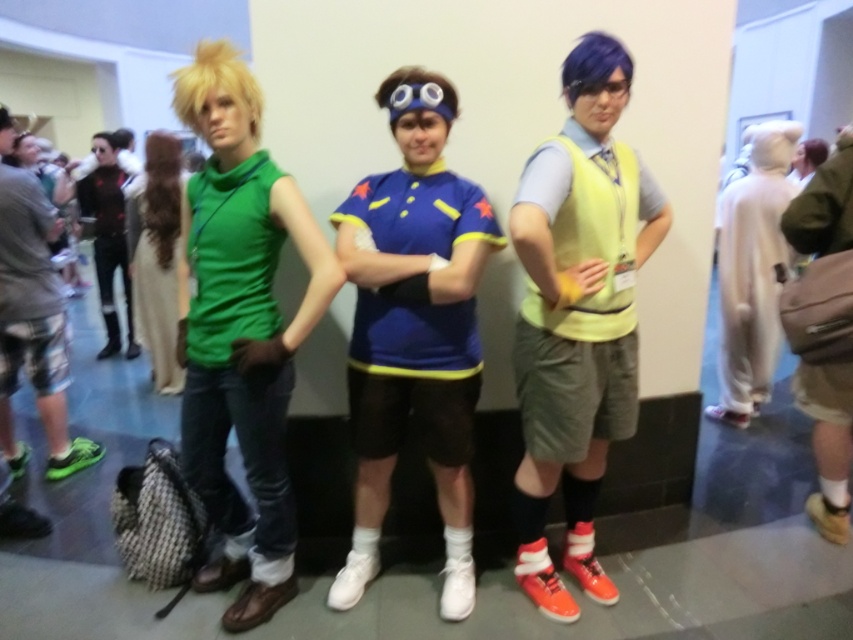
Which is behind, point (814, 400) or point (173, 317)?

The point (173, 317) is more distant.

At what (x,y) coordinates should I click in order to perform the action: click on brown suede backpack at right. Please return your answer as a coordinate pair (x, y). Looking at the image, I should click on (824, 205).

Is green matte t-shirt at left further to the viewer compared to brown suede backpack at right?

That is False.

From the picture: Who is more distant from viewer, (x=289, y=371) or (x=846, y=243)?

The point (x=846, y=243) is behind.

Where is `green matte t-shirt at left`? green matte t-shirt at left is located at coordinates (241, 330).

From the picture: Does green matte turtleneck at left have a greater height compared to matte green turtleneck at center?

Yes, green matte turtleneck at left is taller than matte green turtleneck at center.

Is green matte turtleneck at left to the left of matte green turtleneck at center from the viewer's perspective?

In fact, green matte turtleneck at left is to the right of matte green turtleneck at center.

Identify the location of green matte turtleneck at left. click(230, 353).

At what (x,y) coordinates should I click in order to perform the action: click on green matte turtleneck at left. Please return your answer as a coordinate pair (x, y). This screenshot has width=853, height=640. Looking at the image, I should click on (230, 353).